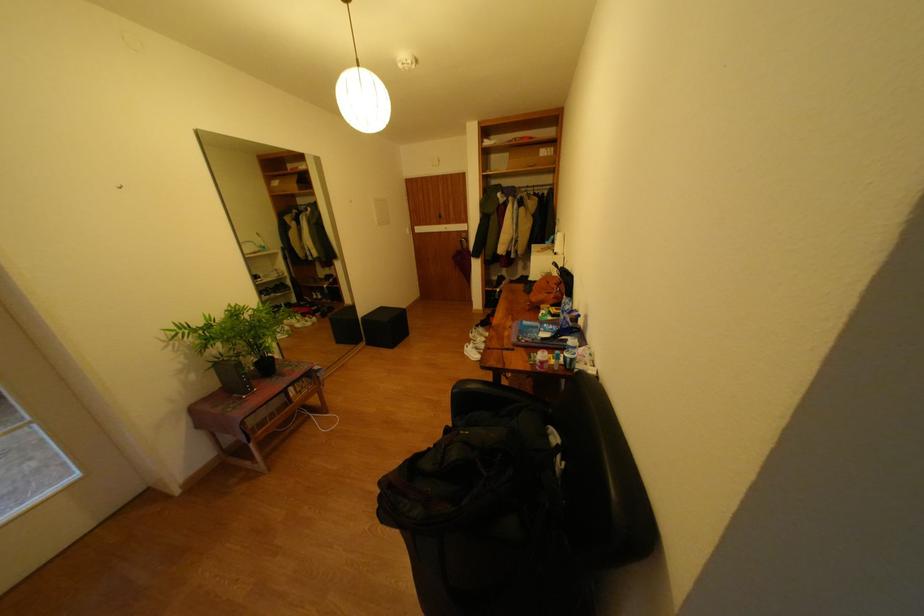
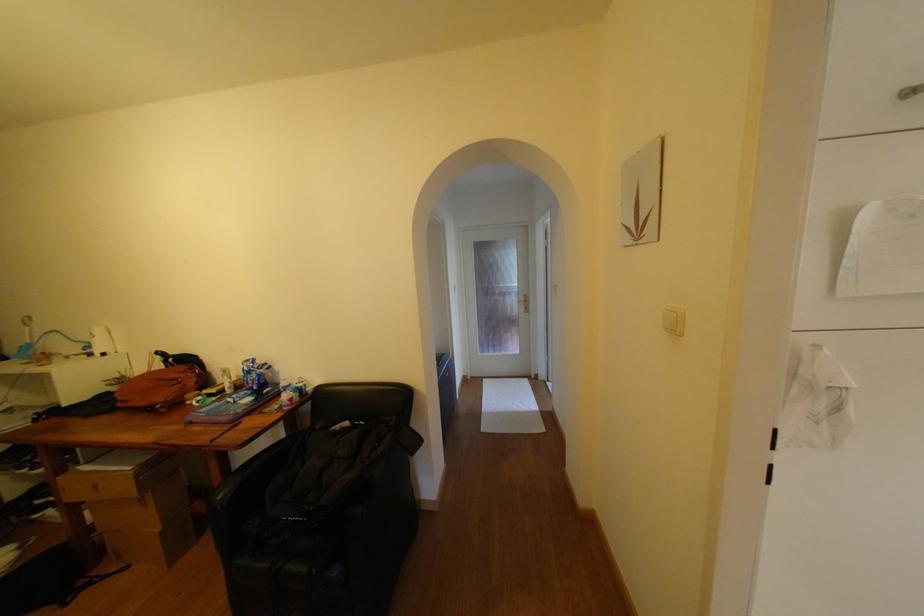
Question: The camera is either moving clockwise (left) or counter-clockwise (right) around the object. The first image is from the beginning of the video and the second image is from the end. Is the camera moving left or right when shooting the video?

Choices:
 (A) Left
 (B) Right

Answer: (A)